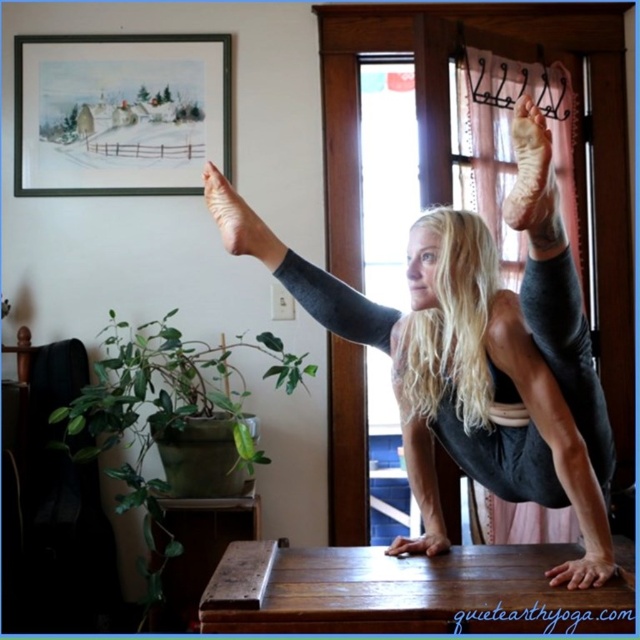
Question: Is matte gray leggings at center thinner than wooden table at center?

Choices:
 (A) no
 (B) yes

Answer: (B)

Question: Does matte gray leggings at center have a greater width compared to wooden table at center?

Choices:
 (A) yes
 (B) no

Answer: (B)

Question: Can you confirm if matte gray leggings at center is bigger than black matte picture frame at upper left?

Choices:
 (A) no
 (B) yes

Answer: (B)

Question: Which object is closer to the camera taking this photo?

Choices:
 (A) wooden table at center
 (B) matte gray leggings at center
 (C) black matte picture frame at upper left

Answer: (B)

Question: Estimate the real-world distances between objects in this image. Which object is closer to the matte gray leggings at center?

Choices:
 (A) wooden table at center
 (B) black matte picture frame at upper left

Answer: (A)

Question: Among these objects, which one is farthest from the camera?

Choices:
 (A) wooden table at center
 (B) matte gray leggings at center
 (C) black matte picture frame at upper left

Answer: (C)